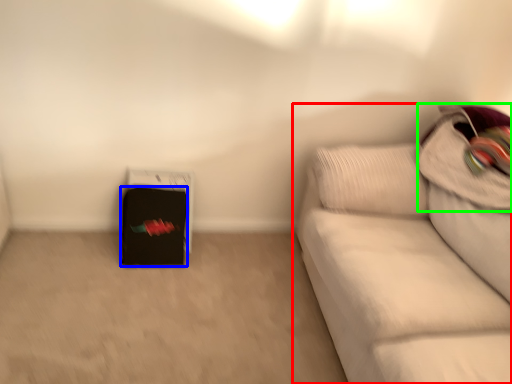
Question: Estimate the real-world distances between objects in this image. Which object is farther from studio couch (highlighted by a red box), luggage (highlighted by a blue box) or pillow (highlighted by a green box)?

Choices:
 (A) luggage
 (B) pillow

Answer: (A)